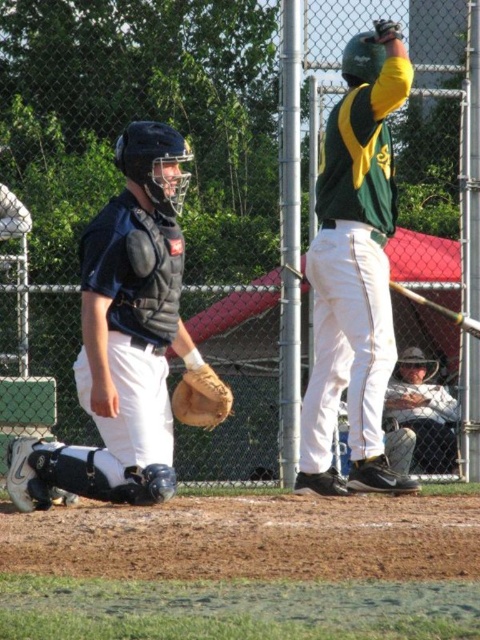
You are a sports analyst watching the game. You need to determine the exact location of the green matte jersey at center. What are its coordinates?

The green matte jersey at center is located at coordinates point (355, 269).